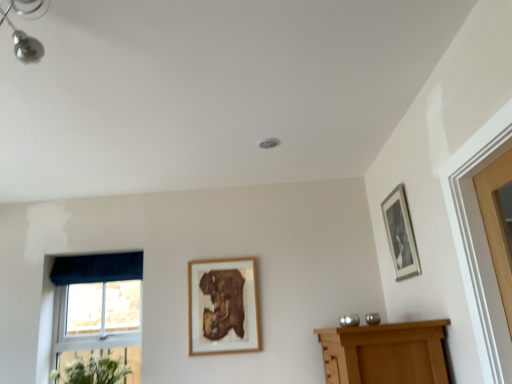
Question: Is velvet dark blue curtain at left positioned with its back to blue fabric window at lower left?

Choices:
 (A) yes
 (B) no

Answer: (A)

Question: Is velvet dark blue curtain at left at the right side of blue fabric window at lower left?

Choices:
 (A) yes
 (B) no

Answer: (B)

Question: Considering the relative sizes of velvet dark blue curtain at left and blue fabric window at lower left in the image provided, is velvet dark blue curtain at left smaller than blue fabric window at lower left?

Choices:
 (A) yes
 (B) no

Answer: (A)

Question: Is velvet dark blue curtain at left positioned in front of blue fabric window at lower left?

Choices:
 (A) yes
 (B) no

Answer: (B)

Question: Is the position of velvet dark blue curtain at left more distant than that of blue fabric window at lower left?

Choices:
 (A) no
 (B) yes

Answer: (B)

Question: Could you tell me if velvet dark blue curtain at left is turned towards blue fabric window at lower left?

Choices:
 (A) yes
 (B) no

Answer: (B)

Question: Is wooden frame at center, arranged as the 2th picture frame when viewed from the top, smaller than blue fabric window at lower left?

Choices:
 (A) yes
 (B) no

Answer: (A)

Question: Does wooden frame at center, which is the second picture frame from right to left, come behind blue fabric window at lower left?

Choices:
 (A) yes
 (B) no

Answer: (B)

Question: Does wooden frame at center, which is the second picture frame from right to left, have a lesser width compared to blue fabric window at lower left?

Choices:
 (A) yes
 (B) no

Answer: (A)

Question: Are wooden frame at center, the second picture frame viewed from the front, and blue fabric window at lower left far apart?

Choices:
 (A) no
 (B) yes

Answer: (A)

Question: Does wooden frame at center, which is the second picture frame from right to left, have a greater width compared to blue fabric window at lower left?

Choices:
 (A) no
 (B) yes

Answer: (A)

Question: Does wooden frame at center, the second picture frame viewed from the front, appear on the left side of blue fabric window at lower left?

Choices:
 (A) yes
 (B) no

Answer: (B)

Question: Can you see blue fabric window at lower left touching wooden frame at center, which is counted as the 1th picture frame, starting from the left?

Choices:
 (A) no
 (B) yes

Answer: (A)